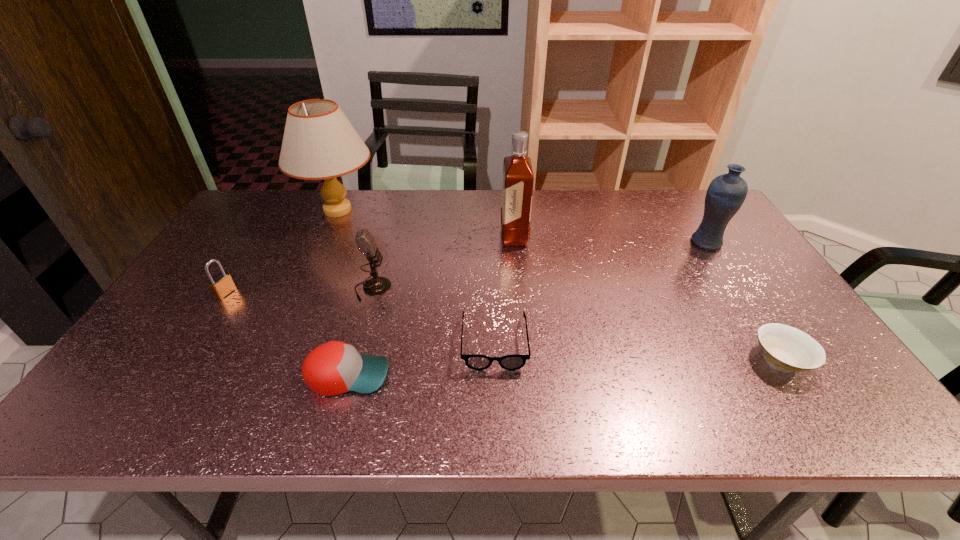
I want to click on vacant space in between the lampshade and the padlock, so click(x=281, y=252).

Where is `the fifth closest object relative to the microphone`? the fifth closest object relative to the microphone is located at coordinates (518, 179).

Identify the location of the third closest object to the liquor. (319, 142).

The image size is (960, 540). I want to click on vacant position in the image that satisfies the following two spatial constraints: 1. on the front side of the vase; 2. at the brim of the third shortest object, so click(793, 375).

Image resolution: width=960 pixels, height=540 pixels. What are the coordinates of `vacant area in the image that satisfies the following two spatial constraints: 1. on the front label of the bowl; 2. on the right side of the liquor` in the screenshot? It's located at coord(526,360).

This screenshot has height=540, width=960. I want to click on free space that satisfies the following two spatial constraints: 1. on the front side of the lampshade; 2. on the left side of the vase, so click(x=324, y=242).

Find the location of a particular element. vacant space that satisfies the following two spatial constraints: 1. on the front-facing side of the bowl; 2. on the left side of the microphone is located at coordinates (353, 360).